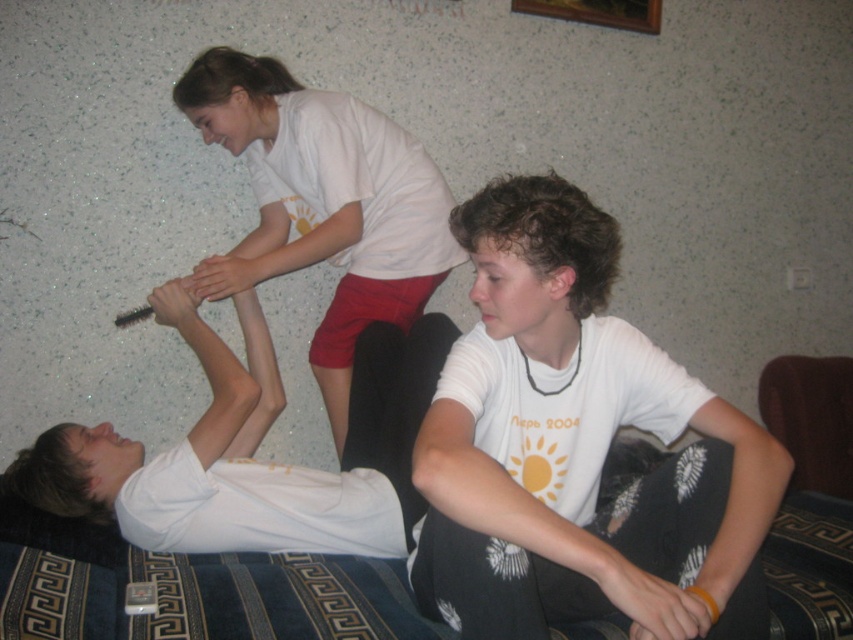
Question: Does dark blue fabric couch at lower center have a greater width compared to white matte shirt at upper center?

Choices:
 (A) no
 (B) yes

Answer: (B)

Question: Which of the following is the closest to the observer?

Choices:
 (A) dark blue fabric couch at lower center
 (B) white matte shirt at upper center
 (C) white matte shirt at center

Answer: (C)

Question: Estimate the real-world distances between objects in this image. Which object is farther from the dark blue fabric couch at lower center?

Choices:
 (A) white matte shirt at center
 (B) white matte shirt at upper center

Answer: (B)

Question: Considering the relative positions of white matte shirt at center and white matte shirt at upper center in the image provided, where is white matte shirt at center located with respect to white matte shirt at upper center?

Choices:
 (A) left
 (B) right

Answer: (B)

Question: In this image, where is dark blue fabric couch at lower center located relative to white matte shirt at upper center?

Choices:
 (A) above
 (B) below

Answer: (B)

Question: Which of the following is the closest to the observer?

Choices:
 (A) (242, 560)
 (B) (380, 116)
 (C) (664, 557)

Answer: (C)